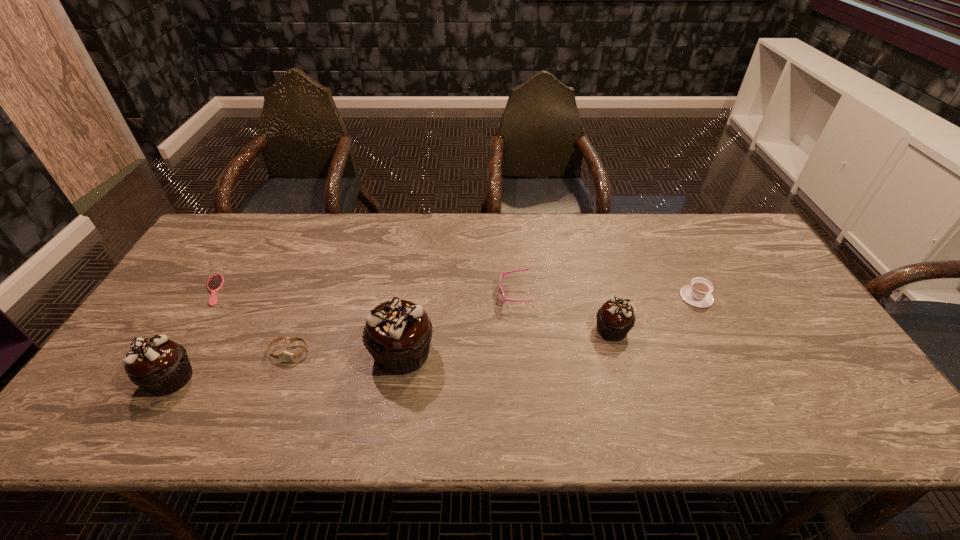
Locate an element on the screen. The image size is (960, 540). the sixth shortest object is located at coordinates (160, 366).

This screenshot has width=960, height=540. I want to click on the leftmost cupcake, so click(160, 366).

Where is `the fourth object from right to left`? This screenshot has width=960, height=540. the fourth object from right to left is located at coordinates (397, 333).

I want to click on the tallest cupcake, so click(x=397, y=333).

Find the location of `the rightmost cupcake`. the rightmost cupcake is located at coordinates (615, 318).

Where is `the fifth shortest object`? This screenshot has height=540, width=960. the fifth shortest object is located at coordinates (615, 318).

What are the coordinates of `the shortest object` in the screenshot? It's located at (215, 282).

Image resolution: width=960 pixels, height=540 pixels. What are the coordinates of `the rightmost object` in the screenshot? It's located at (698, 294).

At what (x,y) coordinates should I click in order to perform the action: click on the third object from right to left. Please return your answer as a coordinate pair (x, y). The image size is (960, 540). Looking at the image, I should click on (502, 275).

At what (x,y) coordinates should I click in order to perform the action: click on watch. Please return your answer as a coordinate pair (x, y). The height and width of the screenshot is (540, 960). Looking at the image, I should click on (284, 356).